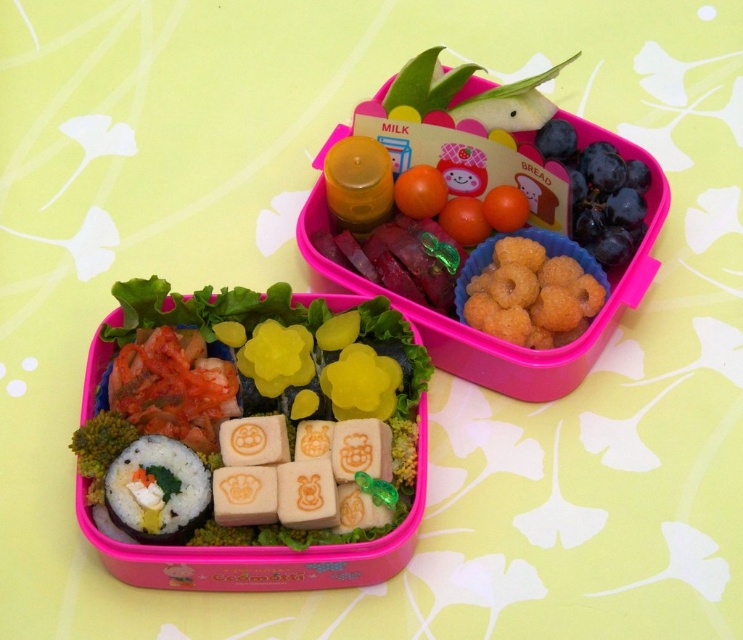
You are standing 4 feet away from the white rice with sushi at lower left. Can you reach it without moving your feet?

The white rice with sushi at lower left is 3.95 feet away from you, so yes, you can reach it without moving your feet since you are standing 4 feet away.

You are a food delivery person who needs to place two items on a tray. The items are the white rice with sushi at lower left and the white rice with fish filling at lower left. The tray has a maximum width of 10 inches. Can both items fit side by side on the tray?

The distance between the white rice with sushi at lower left and the white rice with fish filling at lower left is 9.98 inches, which is just under the tray maximum width of 10 inches. Therefore, both items can fit side by side on the tray.

You are a parent preparing lunch for your child. You have two bento boxes in front of you. The first one has white rice with sushi at lower left and white rice with fish filling at lower left. Which of these two items is positioned higher in the bento box?

The white rice with sushi at lower left is positioned higher than the white rice with fish filling at lower left in the bento box.